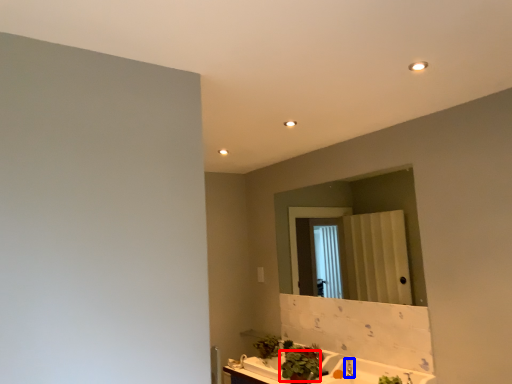
Question: Which of the following is the closest to the observer, plant (highlighted by a red box) or faucet (highlighted by a blue box)?

Choices:
 (A) plant
 (B) faucet

Answer: (A)